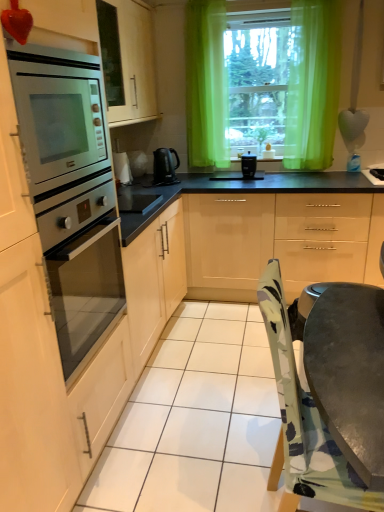
Image resolution: width=384 pixels, height=512 pixels. Find the location of `vacant space in green sheer curtain at upper center (from a real-world perspective)`. vacant space in green sheer curtain at upper center (from a real-world perspective) is located at coordinates (315, 168).